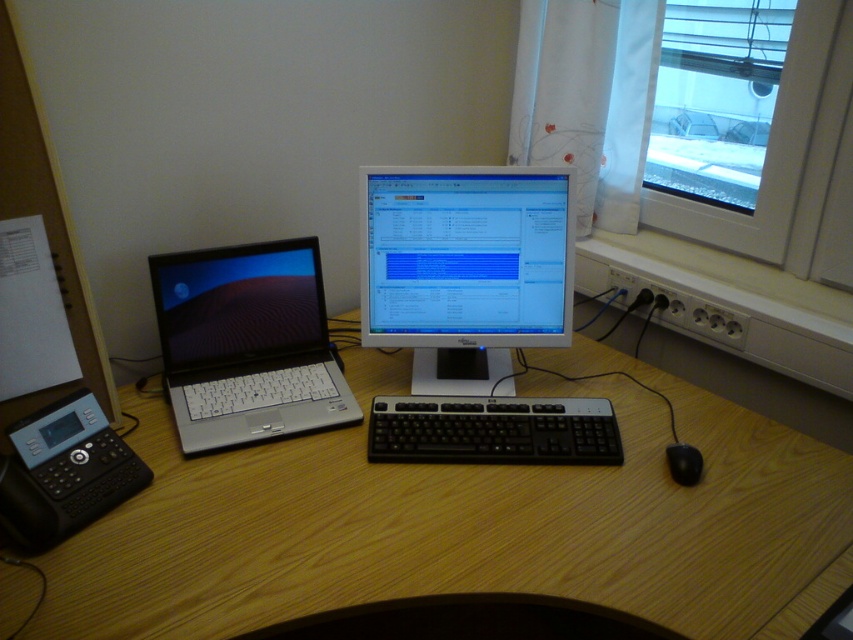
Question: Can you confirm if matte black monitor at center is wider than silver metallic laptop at left?

Choices:
 (A) no
 (B) yes

Answer: (B)

Question: Is matte black monitor at center below black rubber mouse at lower right?

Choices:
 (A) yes
 (B) no

Answer: (B)

Question: Which point is farther from the camera taking this photo?

Choices:
 (A) (819, 86)
 (B) (689, 483)

Answer: (A)

Question: Which object is positioned closest to the silver metallic laptop at left?

Choices:
 (A) black plastic keyboard at center
 (B) transparent glass window at upper right
 (C) black rubber mouse at lower right
 (D) wooden at center

Answer: (D)

Question: Which object is farther from the camera taking this photo?

Choices:
 (A) transparent glass window at upper right
 (B) black rubber mouse at lower right

Answer: (A)

Question: Does wooden at center appear on the left side of transparent glass window at upper right?

Choices:
 (A) yes
 (B) no

Answer: (A)